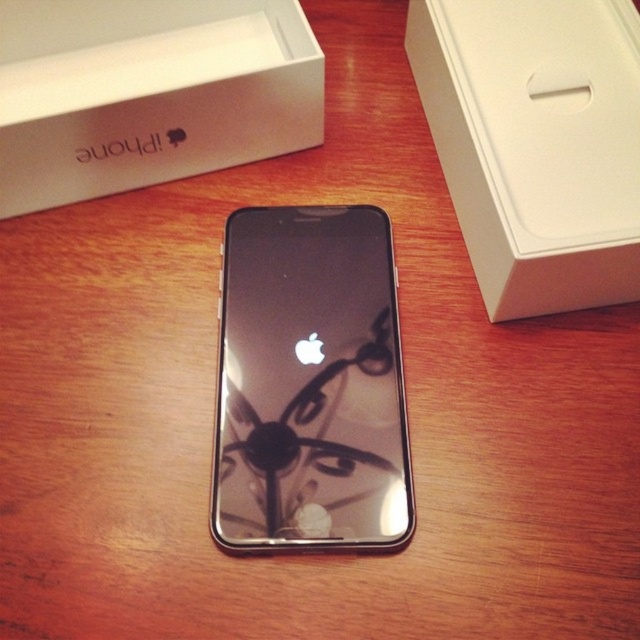
Locate an element on the screen. sleek black phone at center is located at coordinates (308, 384).

Can you confirm if sleek black phone at center is positioned above white matte box at upper right?

Actually, sleek black phone at center is below white matte box at upper right.

The height and width of the screenshot is (640, 640). I want to click on sleek black phone at center, so click(308, 384).

Who is lower down, white matte box at upper right or white matte iphone box at upper left?

Positioned lower is white matte box at upper right.

Which of these two, white matte box at upper right or white matte iphone box at upper left, stands taller?

Standing taller between the two is white matte box at upper right.

Describe the element at coordinates (536, 144) in the screenshot. This screenshot has width=640, height=640. I see `white matte box at upper right` at that location.

Identify the location of white matte box at upper right. The height and width of the screenshot is (640, 640). (536, 144).

Is sleek black phone at center to the right of white matte iphone box at upper left from the viewer's perspective?

Indeed, sleek black phone at center is positioned on the right side of white matte iphone box at upper left.

Consider the image. Does sleek black phone at center come behind white matte iphone box at upper left?

No, sleek black phone at center is in front of white matte iphone box at upper left.

Between point (256, 545) and point (12, 182), which one is positioned behind?

The point (12, 182) is more distant.

Locate an element on the screen. sleek black phone at center is located at coordinates (308, 384).